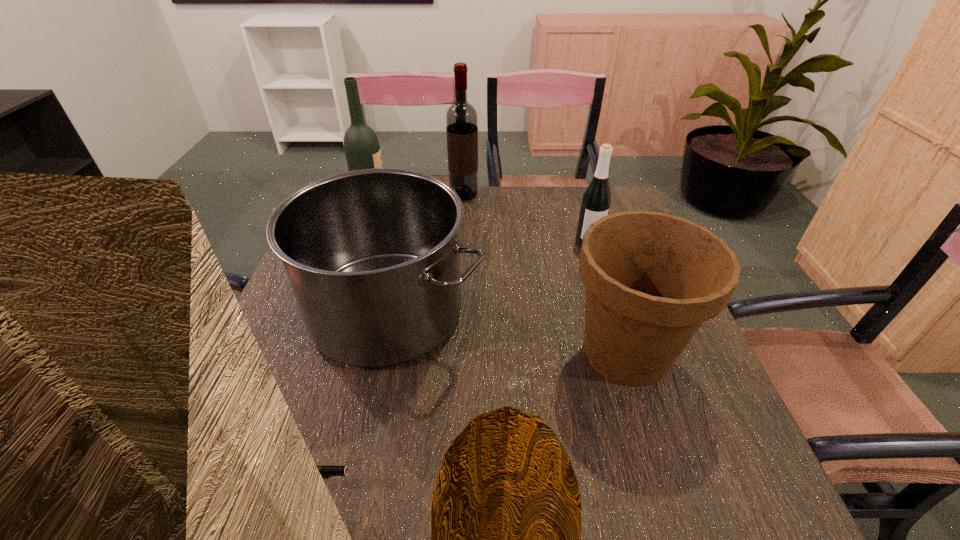
Locate an element on the screen. object that is at the far left corner is located at coordinates (362, 150).

The height and width of the screenshot is (540, 960). I want to click on object that is positioned at the near left corner, so click(x=326, y=471).

Identify the location of free space at the far edge of the desktop. Image resolution: width=960 pixels, height=540 pixels. (510, 226).

You are a GUI agent. You are given a task and a screenshot of the screen. Output one action in this format:
    pyautogui.click(x=<x>, y=<y>)
    Task: Click on the vacant region at the near edge of the desktop
    Image resolution: width=960 pixels, height=540 pixels.
    Given the screenshot: What is the action you would take?
    pyautogui.click(x=325, y=511)

You are a GUI agent. You are given a task and a screenshot of the screen. Output one action in this format:
    pyautogui.click(x=<x>, y=<y>)
    Task: Click on the vacant space at the left edge of the desktop
    The image size is (960, 540).
    Given the screenshot: What is the action you would take?
    tap(258, 408)

Where is `vacant point located between the nearest object and the shortest wine bottle`? Image resolution: width=960 pixels, height=540 pixels. vacant point located between the nearest object and the shortest wine bottle is located at coordinates (452, 367).

This screenshot has width=960, height=540. I want to click on free space between the rightmost wine bottle and the saucepan, so click(x=488, y=277).

Locate which object is the second closest to the pistol. Please provide its 2D coordinates. Your answer should be formatted as a tuple, i.e. [(x, y)], where the tuple contains the x and y coordinates of a point satisfying the conditions above.

[(652, 279)]

The width and height of the screenshot is (960, 540). I want to click on object identified as the fifth closest to the leftmost wine bottle, so click(326, 471).

Identify which wine bottle is the closest to the pistol. Please provide its 2D coordinates. Your answer should be formatted as a tuple, i.e. [(x, y)], where the tuple contains the x and y coordinates of a point satisfying the conditions above.

[(596, 200)]